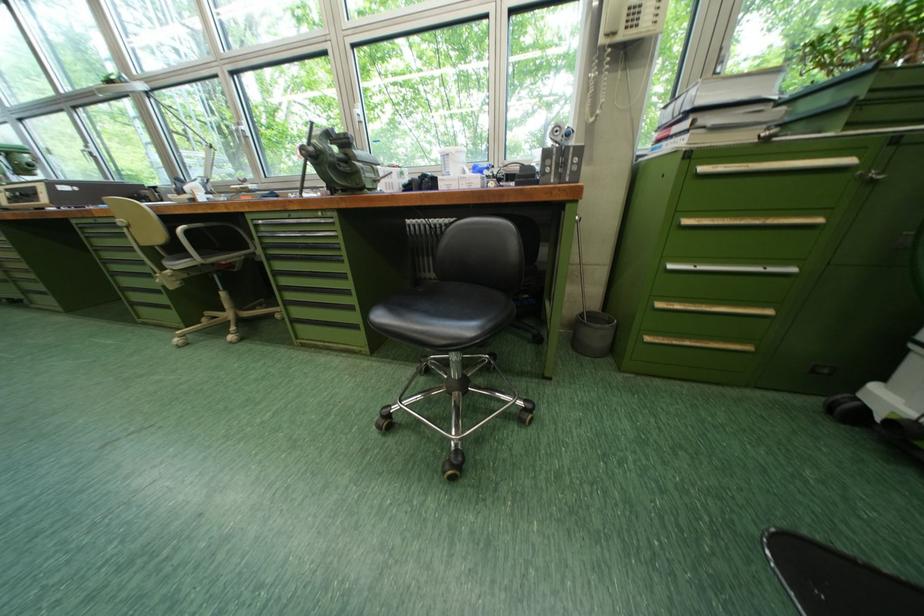
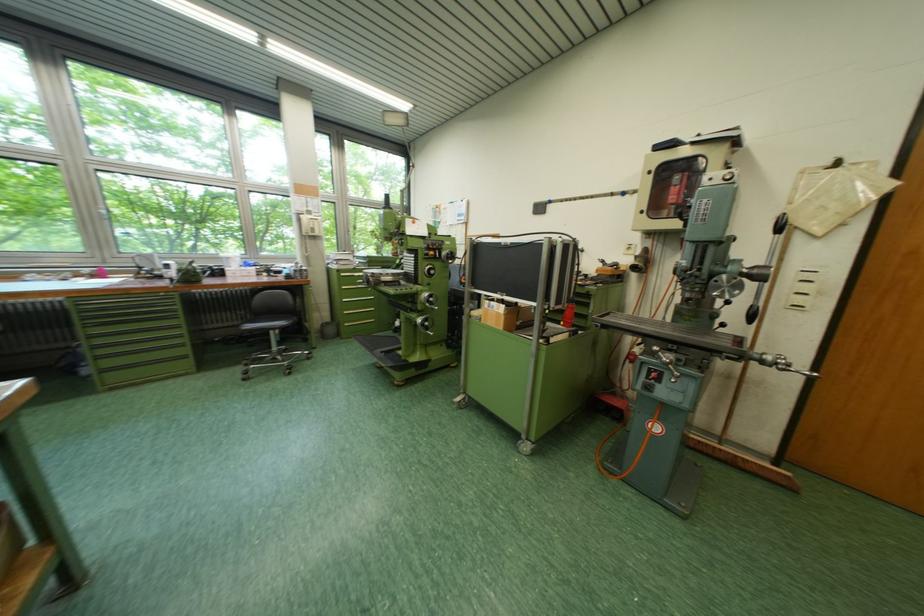
In the second image, find the point that corresponds to pixel 780 315 in the first image.

(383, 312)